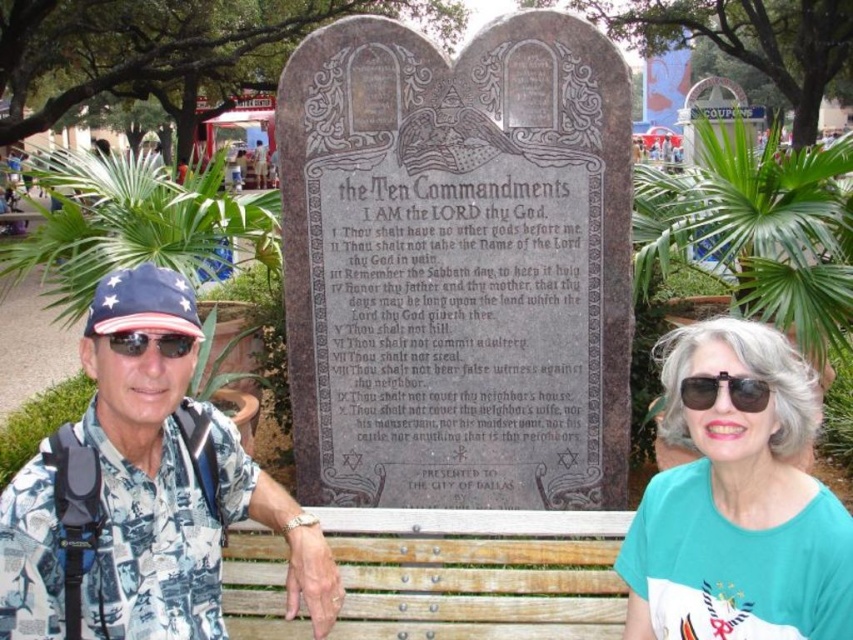
Can you confirm if black plastic sunglasses at center is positioned below sunglasses at left?

Correct, black plastic sunglasses at center is located below sunglasses at left.

Who is positioned more to the right, black plastic sunglasses at center or sunglasses at left?

black plastic sunglasses at center is more to the right.

Who is more forward, (758,381) or (146,332)?

Point (758,381) is more forward.

Locate an element on the screen. The height and width of the screenshot is (640, 853). black plastic sunglasses at center is located at coordinates (727, 392).

Who is shorter, white printed shirt at left or teal fabric shirt at right?

teal fabric shirt at right is shorter.

Is white printed shirt at left taller than teal fabric shirt at right?

Yes, white printed shirt at left is taller than teal fabric shirt at right.

Who is more forward, (312, 529) or (717, 532)?

Point (717, 532) is in front.

Where is `white printed shirt at left`? white printed shirt at left is located at coordinates (143, 496).

Is point (167, 417) farther from viewer compared to point (165, 352)?

Yes.

Where is `white printed shirt at left`? The image size is (853, 640). white printed shirt at left is located at coordinates (143, 496).

Between point (152, 454) and point (126, 346), which one is positioned behind?

Point (152, 454)

The height and width of the screenshot is (640, 853). In order to click on white printed shirt at left in this screenshot , I will do `click(143, 496)`.